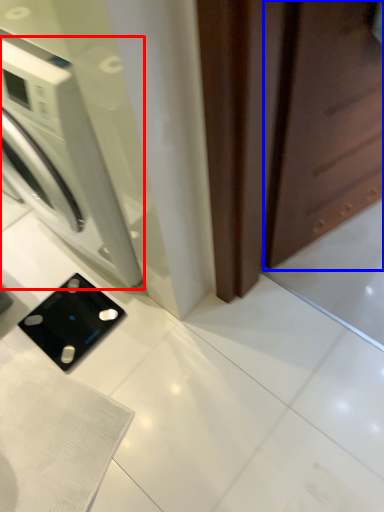
Question: Which object is closer to the camera taking this photo, washing machine (highlighted by a red box) or screen door (highlighted by a blue box)?

Choices:
 (A) washing machine
 (B) screen door

Answer: (B)